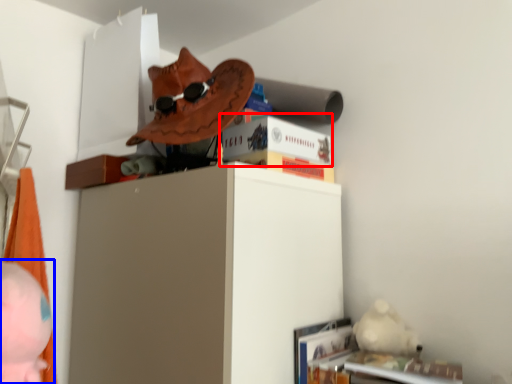
Question: Which point is further to the camera, paperback book (highlighted by a red box) or person (highlighted by a blue box)?

Choices:
 (A) paperback book
 (B) person

Answer: (A)